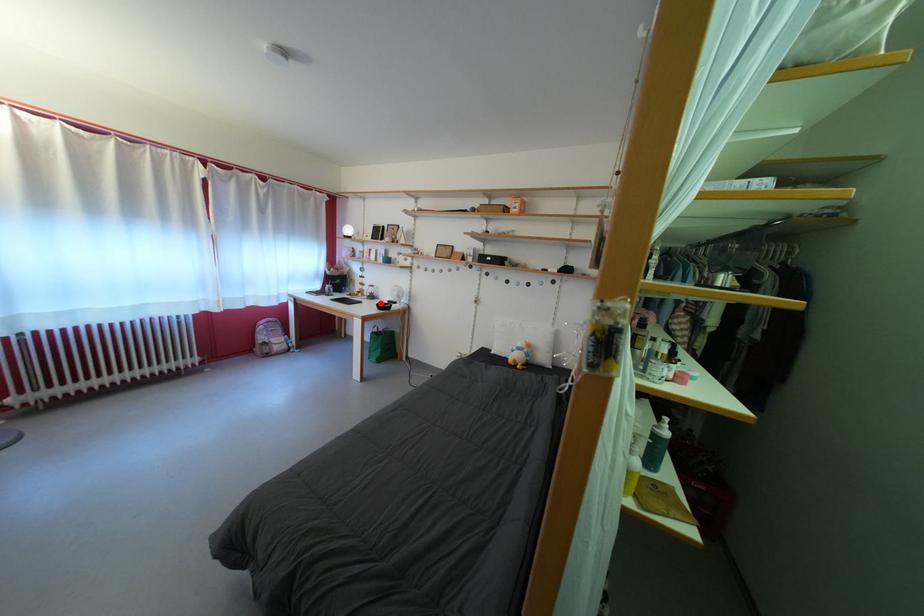
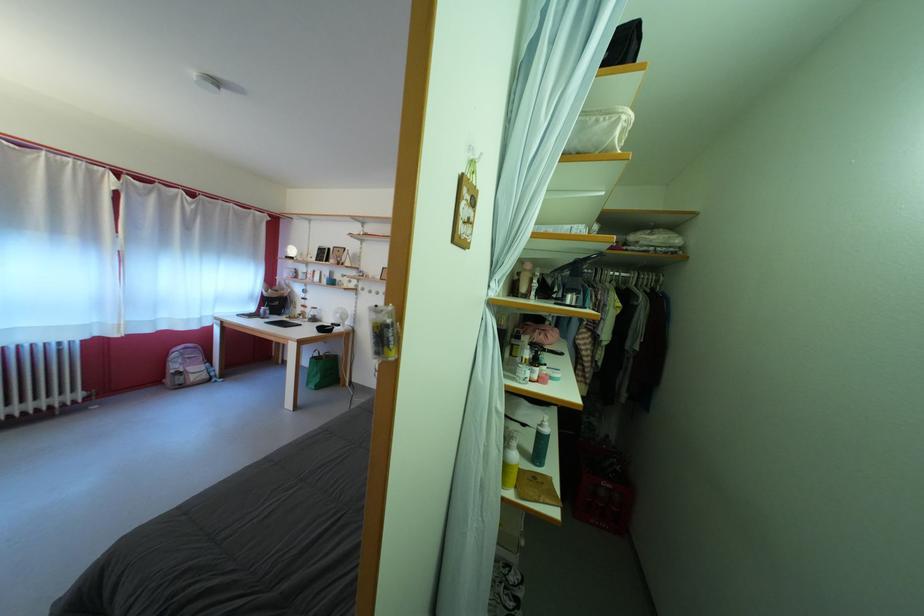
In the second image, find the point that corresponds to the highlighted location in the first image.

(322, 325)